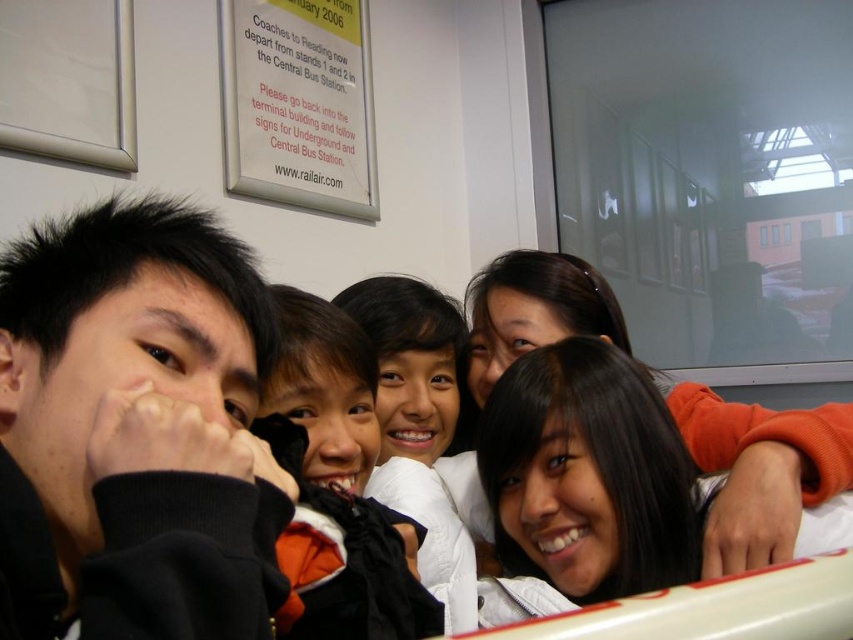
Who is positioned more to the right, black fleece at left or orange fleece jacket at center?

From the viewer's perspective, orange fleece jacket at center appears more on the right side.

Can you confirm if black fleece at left is bigger than orange fleece jacket at center?

Yes.

The image size is (853, 640). I want to click on black fleece at left, so click(132, 429).

Is orange fleece jacket at center above white paper sign at upper center?

Incorrect, orange fleece jacket at center is not positioned above white paper sign at upper center.

Is point (289, 568) less distant than point (294, 193)?

Yes, it is in front of point (294, 193).

I want to click on orange fleece jacket at center, so click(x=341, y=484).

Who is higher up, black fleece at left or white paper sign at upper center?

white paper sign at upper center is higher up.

Is black fleece at left further to camera compared to white paper sign at upper center?

No, it is not.

The height and width of the screenshot is (640, 853). Find the location of `black fleece at left`. black fleece at left is located at coordinates (132, 429).